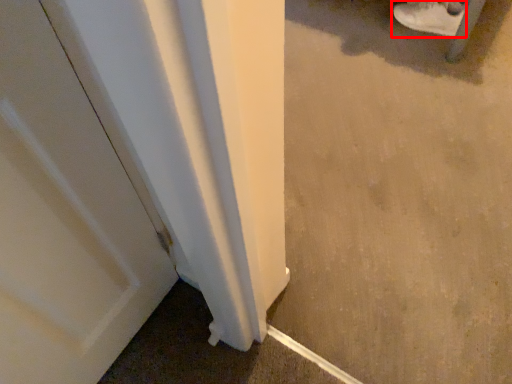
Question: In this image, where is footwear (annotated by the red box) located relative to concrete?

Choices:
 (A) left
 (B) right

Answer: (B)